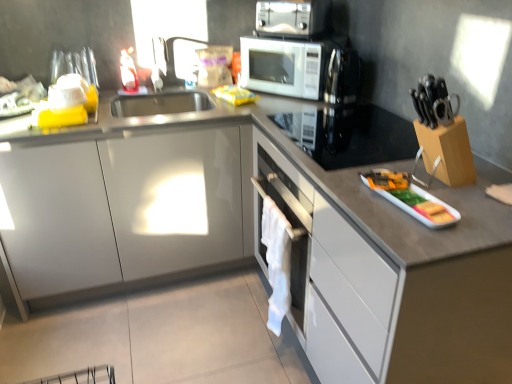
Measure the distance between point (x=295, y=33) and camera.

Point (x=295, y=33) is 2.05 meters away from camera.

Measure the distance between white fabric at center and camera.

The distance of white fabric at center from camera is 5.15 feet.

Measure the distance between white glossy microwave at upper center and camera.

white glossy microwave at upper center and camera are 6.37 feet apart from each other.

What is the approximate width of white glossy microwave at upper center?

white glossy microwave at upper center is 12.86 inches wide.

Where is `black glass cooktop at upper right, which is counted as the second appliance, starting from the bottom`? black glass cooktop at upper right, which is counted as the second appliance, starting from the bottom is located at coordinates (350, 135).

This screenshot has height=384, width=512. What do you see at coordinates (350, 135) in the screenshot?
I see `black glass cooktop at upper right, the first appliance from the back` at bounding box center [350, 135].

Image resolution: width=512 pixels, height=384 pixels. Describe the element at coordinates (234, 94) in the screenshot. I see `yellow plastic bag at upper center` at that location.

The height and width of the screenshot is (384, 512). What are the coordinates of `metallic silver toaster oven at upper center` in the screenshot? It's located at (293, 18).

Considering the positions of points (402, 199) and (438, 257), is point (402, 199) closer to camera compared to point (438, 257)?

No.

From a real-world perspective, between white glossy tray at right, marked as the second appliance in a back-to-front arrangement, and white glossy drawer at right, who is vertically higher?

In real-world perspective, white glossy tray at right, marked as the second appliance in a back-to-front arrangement, is above.

Can you confirm if white glossy drawer at right is smaller than yellow plastic bag at upper center?

No.

Between point (485, 320) and point (247, 90), which one is positioned in front?

The point (485, 320) is closer to the camera.

Between white glossy drawer at right and yellow plastic bag at upper center, which one has less height?

yellow plastic bag at upper center.

From a real-world perspective, which object stands above the other?

yellow plastic bag at upper center, from a real-world perspective.

Is white glossy microwave at upper center positioned with its back to black glass cooktop at upper right, placed as the 1th appliance when sorted from top to bottom?

No.

Does white glossy microwave at upper center have a lesser width compared to black glass cooktop at upper right, placed as the 1th appliance when sorted from top to bottom?

Indeed, white glossy microwave at upper center has a lesser width compared to black glass cooktop at upper right, placed as the 1th appliance when sorted from top to bottom.

Are white glossy microwave at upper center and black glass cooktop at upper right, the first appliance from the back, far apart?

No.

Is the position of white glossy drawer at right more distant than that of black glass cooktop at upper right, the first appliance from the back?

No, white glossy drawer at right is in front of black glass cooktop at upper right, the first appliance from the back.

Based on the photo, measure the distance from white glossy drawer at right to black glass cooktop at upper right, which is counted as the second appliance, starting from the bottom.

They are 36.34 centimeters apart.

From the image's perspective, does white glossy drawer at right appear lower than black glass cooktop at upper right, which is counted as the second appliance, starting from the bottom?

Yes.

Is white glossy drawer at right with black glass cooktop at upper right, placed as the 1th appliance when sorted from top to bottom?

No, white glossy drawer at right is not with black glass cooktop at upper right, placed as the 1th appliance when sorted from top to bottom.

From the image's perspective, relative to yellow plastic bag at upper center, is metallic silver toaster oven at upper center above or below?

Clearly, from the image's perspective, metallic silver toaster oven at upper center is above yellow plastic bag at upper center.

From the picture: Who is more distant, metallic silver toaster oven at upper center or yellow plastic bag at upper center?

yellow plastic bag at upper center is further away from the camera.

Is metallic silver toaster oven at upper center wider than yellow plastic bag at upper center?

Correct, the width of metallic silver toaster oven at upper center exceeds that of yellow plastic bag at upper center.

Is black glass cooktop at upper right, the first appliance from the back, to the left of yellow plastic bag at upper center from the viewer's perspective?

In fact, black glass cooktop at upper right, the first appliance from the back, is to the right of yellow plastic bag at upper center.

Considering the relative sizes of black glass cooktop at upper right, placed as the 1th appliance when sorted from top to bottom, and yellow plastic bag at upper center in the image provided, is black glass cooktop at upper right, placed as the 1th appliance when sorted from top to bottom, thinner than yellow plastic bag at upper center?

No.

From a real-world perspective, is black glass cooktop at upper right, which is counted as the second appliance, starting from the bottom, on top of yellow plastic bag at upper center?

Incorrect, from a real-world perspective, black glass cooktop at upper right, which is counted as the second appliance, starting from the bottom, is lower than yellow plastic bag at upper center.

Relative to yellow plastic bag at upper center, is black glass cooktop at upper right, the first appliance from the back, in front or behind?

Visually, black glass cooktop at upper right, the first appliance from the back, is located in front of yellow plastic bag at upper center.

From the image's perspective, is white glossy microwave at upper center above white glossy tray at right, marked as the second appliance in a back-to-front arrangement?

Yes.

Can you tell me how much white glossy microwave at upper center and white glossy tray at right, which appears as the 1th appliance when ordered from the bottom, differ in facing direction?

They differ by 35.8 degrees in their facing directions.

Based on the photo, is white glossy microwave at upper center far from white glossy tray at right, marked as the second appliance in a back-to-front arrangement?

No, white glossy microwave at upper center is not far from white glossy tray at right, marked as the second appliance in a back-to-front arrangement.

Which is more to the left, white glossy microwave at upper center or white glossy tray at right, the 1th appliance viewed from the front?

Positioned to the left is white glossy microwave at upper center.

What are the coordinates of `cabinetry in front of the white glossy tray at right, the second appliance in the top-to-bottom sequence` in the screenshot? It's located at (400, 283).

Where is `food on the left side of white glossy drawer at right`? The width and height of the screenshot is (512, 384). food on the left side of white glossy drawer at right is located at coordinates (234, 94).

Looking at the image, which one is located further to white fabric at center, yellow plastic bag at upper center or metallic silver toaster oven at upper center?

metallic silver toaster oven at upper center is further to white fabric at center.

When comparing their distances from black glass cooktop at upper right, the first appliance from the back, does white glossy microwave at upper center or white glossy drawer at right seem further?

Among the two, white glossy microwave at upper center is located further to black glass cooktop at upper right, the first appliance from the back.

Estimate the real-world distances between objects in this image. Which object is further from yellow plastic bag at upper center, black glass cooktop at upper right, placed as the 1th appliance when sorted from top to bottom, or white glossy drawer at right?

white glossy drawer at right.

When comparing their distances from white glossy drawer at right, does white glossy tray at right, which appears as the 1th appliance when ordered from the bottom, or metallic silver toaster oven at upper center seem further?

metallic silver toaster oven at upper center is further to white glossy drawer at right.

Looking at this image, looking at the image, which one is located further to black glass cooktop at upper right, which ranks as the second appliance in front-to-back order, yellow plastic bag at upper center or metallic silver toaster oven at upper center?

Based on the image, metallic silver toaster oven at upper center appears to be further to black glass cooktop at upper right, which ranks as the second appliance in front-to-back order.

From the image, which object appears to be farther from white fabric at center, yellow plastic bag at upper center or white glossy drawer at right?

yellow plastic bag at upper center.

Considering their positions, is metallic silver toaster oven at upper center positioned further to white glossy tray at right, which appears as the 1th appliance when ordered from the bottom, than white glossy drawer at right?

metallic silver toaster oven at upper center is further to white glossy tray at right, which appears as the 1th appliance when ordered from the bottom.

When comparing their distances from yellow plastic bag at upper center, does white glossy microwave at upper center or metallic silver toaster oven at upper center seem further?

Based on the image, metallic silver toaster oven at upper center appears to be further to yellow plastic bag at upper center.

The width and height of the screenshot is (512, 384). Find the location of `home appliance between metallic silver toaster oven at upper center and white glossy drawer at right from top to bottom`. home appliance between metallic silver toaster oven at upper center and white glossy drawer at right from top to bottom is located at coordinates (284, 66).

In order to click on home appliance between white glossy drawer at right and yellow plastic bag at upper center from front to back in this screenshot , I will do `click(284, 66)`.

Where is `food between metallic silver toaster oven at upper center and white fabric at center in the vertical direction`? This screenshot has width=512, height=384. food between metallic silver toaster oven at upper center and white fabric at center in the vertical direction is located at coordinates (234, 94).

Image resolution: width=512 pixels, height=384 pixels. In order to click on cloth between black glass cooktop at upper right, which ranks as the second appliance in front-to-back order, and white glossy drawer at right vertically in this screenshot , I will do tap(277, 261).